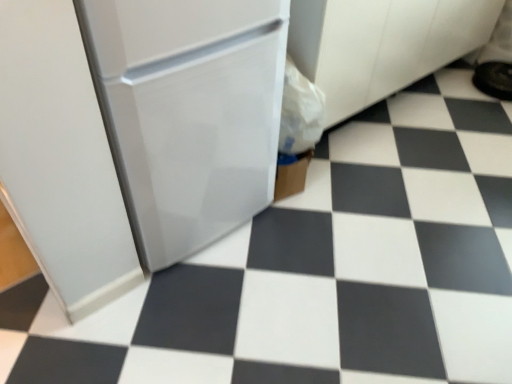
Identify the location of white glossy refrigerator at center. This screenshot has width=512, height=384. (188, 112).

What do you see at coordinates (188, 112) in the screenshot?
I see `white glossy refrigerator at center` at bounding box center [188, 112].

What is the approximate width of white glossy refrigerator at center?

The width of white glossy refrigerator at center is 29.94 inches.

Locate an element on the screen. black rubber shoe at upper right is located at coordinates (494, 79).

Measure the distance between point (511, 80) and camera.

The depth of point (511, 80) is 2.71 meters.

This screenshot has width=512, height=384. Describe the element at coordinates (494, 79) in the screenshot. I see `black rubber shoe at upper right` at that location.

What is the approximate height of black rubber shoe at upper right?

black rubber shoe at upper right is 4.11 inches tall.

Where is `white glossy refrigerator at center`? The width and height of the screenshot is (512, 384). white glossy refrigerator at center is located at coordinates (188, 112).

Which object is positioned more to the right, black rubber shoe at upper right or white glossy refrigerator at center?

Positioned to the right is black rubber shoe at upper right.

Which object is closer to the camera, black rubber shoe at upper right or white glossy refrigerator at center?

white glossy refrigerator at center is in front.

Considering the positions of point (507, 79) and point (270, 39), is point (507, 79) closer or farther from the camera than point (270, 39)?

Point (507, 79) is positioned farther from the camera compared to point (270, 39).

Looking at this image, from the image's perspective, relative to white glossy refrigerator at center, is black rubber shoe at upper right above or below?

black rubber shoe at upper right is above white glossy refrigerator at center.

From a real-world perspective, who is located higher, black rubber shoe at upper right or white glossy refrigerator at center?

In real-world perspective, white glossy refrigerator at center is above.

Which object is thinner, black rubber shoe at upper right or white glossy refrigerator at center?

Thinner between the two is black rubber shoe at upper right.

Considering the sizes of objects black rubber shoe at upper right and white glossy refrigerator at center in the image provided, who is shorter, black rubber shoe at upper right or white glossy refrigerator at center?

With less height is black rubber shoe at upper right.

Who is smaller, black rubber shoe at upper right or white glossy refrigerator at center?

Smaller between the two is black rubber shoe at upper right.

Is white glossy refrigerator at center surrounded by black rubber shoe at upper right?

No, white glossy refrigerator at center is not surrounded by black rubber shoe at upper right.

Would you consider black rubber shoe at upper right to be distant from white glossy refrigerator at center?

Yes, black rubber shoe at upper right and white glossy refrigerator at center are located far from each other.

Is black rubber shoe at upper right oriented towards white glossy refrigerator at center?

No, black rubber shoe at upper right is not turned towards white glossy refrigerator at center.

How different are the orientations of black rubber shoe at upper right and white glossy refrigerator at center in degrees?

There is a 90.2-degree angle between the facing directions of black rubber shoe at upper right and white glossy refrigerator at center.

Consider the image. How far apart are black rubber shoe at upper right and white glossy refrigerator at center?

black rubber shoe at upper right and white glossy refrigerator at center are 2.04 meters apart from each other.

In order to click on appliance positioned vertically above the black rubber shoe at upper right (from a real-world perspective) in this screenshot , I will do `click(188, 112)`.

From the picture: Which is more to the right, white glossy refrigerator at center or black rubber shoe at upper right?

From the viewer's perspective, black rubber shoe at upper right appears more on the right side.

Relative to black rubber shoe at upper right, is white glossy refrigerator at center in front or behind?

Visually, white glossy refrigerator at center is located in front of black rubber shoe at upper right.

Is point (239, 166) positioned after point (503, 98)?

No, it is not.

From the image's perspective, is white glossy refrigerator at center located above or below black rubber shoe at upper right?

From the image's perspective, white glossy refrigerator at center appears below black rubber shoe at upper right.

From a real-world perspective, is white glossy refrigerator at center physically below black rubber shoe at upper right?

No, from a real-world perspective, white glossy refrigerator at center is not below black rubber shoe at upper right.

Is white glossy refrigerator at center thinner than black rubber shoe at upper right?

No, white glossy refrigerator at center is not thinner than black rubber shoe at upper right.

Looking at this image, who is taller, white glossy refrigerator at center or black rubber shoe at upper right?

white glossy refrigerator at center is taller.

Which of these two, white glossy refrigerator at center or black rubber shoe at upper right, is smaller?

Smaller between the two is black rubber shoe at upper right.

Can black rubber shoe at upper right be found inside white glossy refrigerator at center?

No, black rubber shoe at upper right is not surrounded by white glossy refrigerator at center.

Would you say white glossy refrigerator at center is a long distance from black rubber shoe at upper right?

Indeed, white glossy refrigerator at center is not near black rubber shoe at upper right.

Could you tell me if white glossy refrigerator at center is turned towards black rubber shoe at upper right?

No, white glossy refrigerator at center is not facing towards black rubber shoe at upper right.

Identify the location of footwear located behind the white glossy refrigerator at center. (494, 79).

Where is `footwear directly beneath the white glossy refrigerator at center (from a real-world perspective)`? footwear directly beneath the white glossy refrigerator at center (from a real-world perspective) is located at coordinates (494, 79).

In order to click on appliance that is on the left side of black rubber shoe at upper right in this screenshot , I will do `click(188, 112)`.